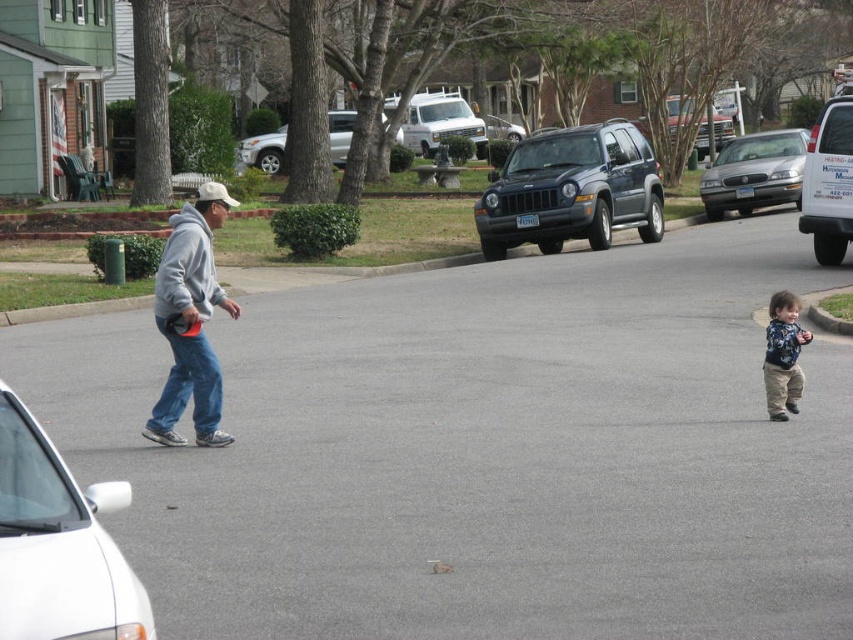
You are a delivery person driving a truck that is 2 meters wide. You need to park your truck between the white glossy car at lower left and the white matte van at right. Is there enough space between them?

The white glossy car at lower left has a lesser width compared to white matte van at right. However, the total space between them depends on their combined widths and any additional spacing. Since the question only provides the relative widths of the cars but not the exact distances between them, it is impossible to determine if there is sufficient space for the 2 meter wide truck without more information about the actual gap between the two vehicles.

You are a pedestrian standing at the edge of the street. You see the white glossy car at lower left and the blue patterned shirt at right. Which object is nearer to you?

The white glossy car at lower left is closer to the viewer than the blue patterned shirt at right.